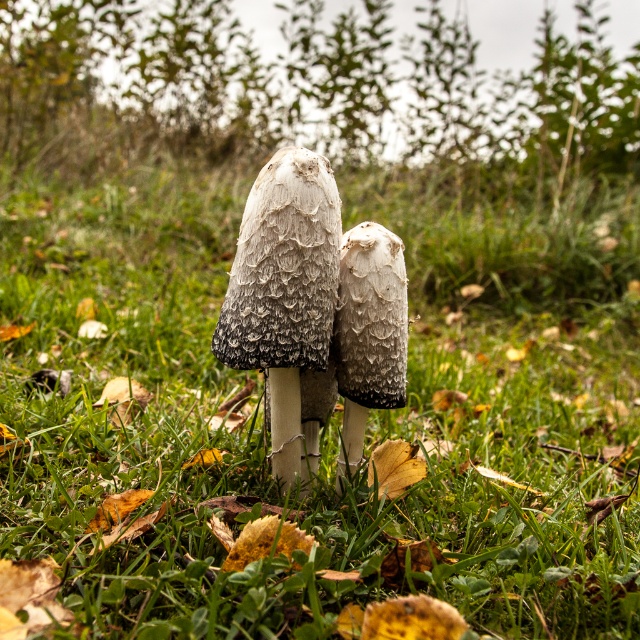
You are a photographer trying to capture both points in the image. Which point, point (324,180) or point (346,396), is closer to your camera lens?

Point (324,180) is closer to the camera lens than point (346,396).

Based on the photo, you are a mycologist examining a closeup of two mushrooms in a grassy area. You notice a point marked at coordinates (285, 298). Which mushroom does this point correspond to?

The point at coordinates (285, 298) corresponds to the fuzzy white mushroom at center.

You are a gardener who wants to plant a new flower between the fuzzy white mushroom at center and the fuzzy gray mushroom at center. The flower requires a minimum of 6 inches of space to grow properly. Based on the image, do you think there is enough space between the two mushrooms to plant the flower?

The distance between the fuzzy white mushroom at center and the fuzzy gray mushroom at center is 5.18 inches, which is less than the required 6 inches. Therefore, there is not enough space to plant the flower between them.